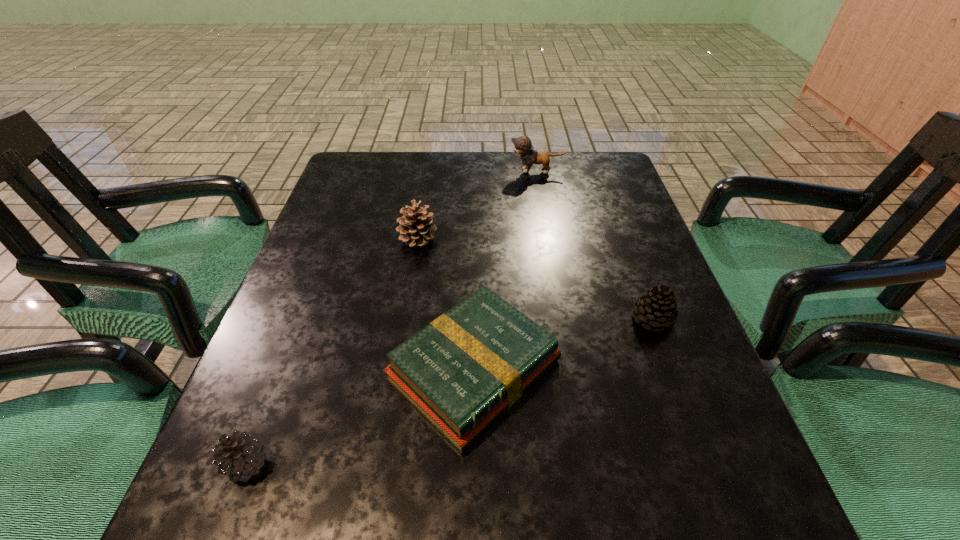
Where is `vacant space located 0.190m on the front-facing side of the farthest object`? vacant space located 0.190m on the front-facing side of the farthest object is located at coordinates (443, 171).

The image size is (960, 540). Identify the location of vacant space located 0.170m on the front of the farthest pinecone. (407, 306).

Locate an element on the screen. free region located 0.340m at the narrow end of the second nearest pinecone is located at coordinates (732, 537).

Where is `vacant space located 0.400m on the right of the nearest pinecone`? This screenshot has height=540, width=960. vacant space located 0.400m on the right of the nearest pinecone is located at coordinates (538, 464).

At what (x,y) coordinates should I click in order to perform the action: click on free space located 0.180m on the back of the shortest object. Please return your answer as a coordinate pair (x, y). Looking at the image, I should click on (475, 247).

Identify the location of object present at the far edge. (522, 145).

The height and width of the screenshot is (540, 960). Identify the location of object present at the near edge. (242, 456).

In order to click on object that is at the left edge in this screenshot , I will do coord(242,456).

Identify the location of kitten that is positioned at the right edge. (522, 145).

Identify the location of pinecone that is at the right edge. (656, 308).